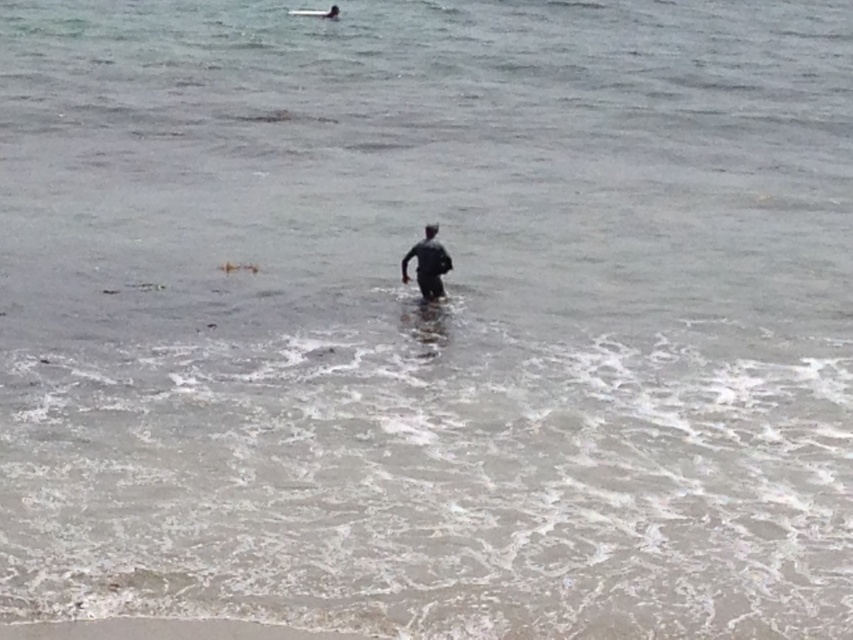
You are a photographer trying to capture the perfect shot of the smooth sand at lower center and the white foam surfboard at center. Since you want both objects in the frame, which object should you position closer to the left side of your camera viewfinder?

The white foam surfboard at center is already positioned to the left of the smooth sand at lower center, so to include both in the frame, you should position the white foam surfboard at center closer to the left side of your camera viewfinder.

You are a photographer trying to capture the entire scene of the dark gray wetsuit at center and the white foam surfboard at center in one shot. Based on their sizes, which object would you need to position closer to the camera to ensure both fit within the frame?

The dark gray wetsuit at center occupies less space than the white foam surfboard at center, so you should position the dark gray wetsuit at center closer to the camera to ensure both fit within the frame.